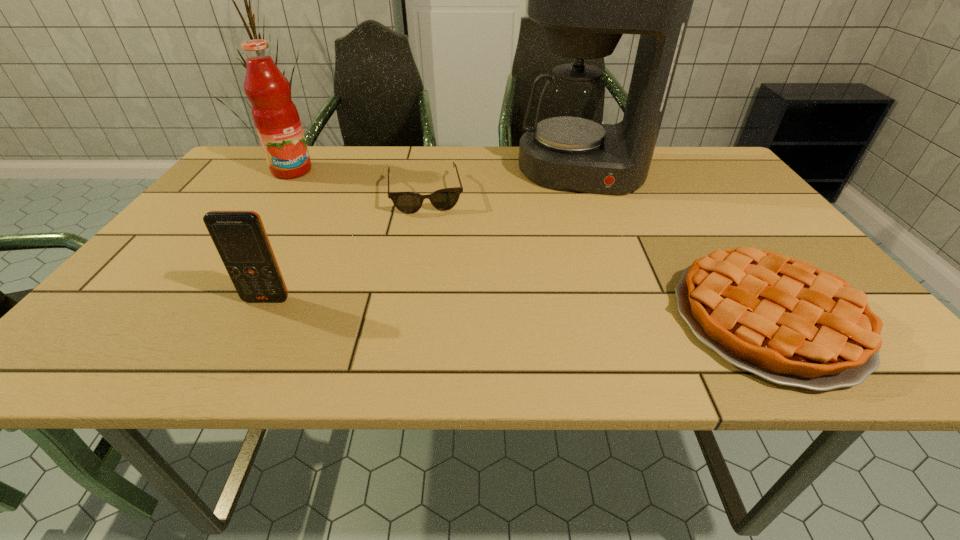
Where is `cellular telephone situated at the near edge`? Image resolution: width=960 pixels, height=540 pixels. cellular telephone situated at the near edge is located at coordinates (240, 238).

The image size is (960, 540). I want to click on pie at the near edge, so click(x=785, y=320).

What are the coordinates of `object at the left edge` in the screenshot? It's located at (275, 116).

What are the coordinates of `object that is at the right edge` in the screenshot? It's located at (785, 320).

The image size is (960, 540). Identify the location of object situated at the far left corner. (275, 116).

Locate an element on the screen. object that is at the near right corner is located at coordinates (785, 320).

Where is `free space at the far edge`? This screenshot has height=540, width=960. free space at the far edge is located at coordinates (656, 157).

I want to click on vacant space at the near edge of the desktop, so click(x=547, y=310).

You are a GUI agent. You are given a task and a screenshot of the screen. Output one action in this format:
    pyautogui.click(x=<x>, y=<y>)
    Task: Click on the vacant position at the right edge of the desktop
    The image size is (960, 540).
    Given the screenshot: What is the action you would take?
    pyautogui.click(x=729, y=228)

Identify the location of vacant space at the far left corner of the desktop. (269, 174).